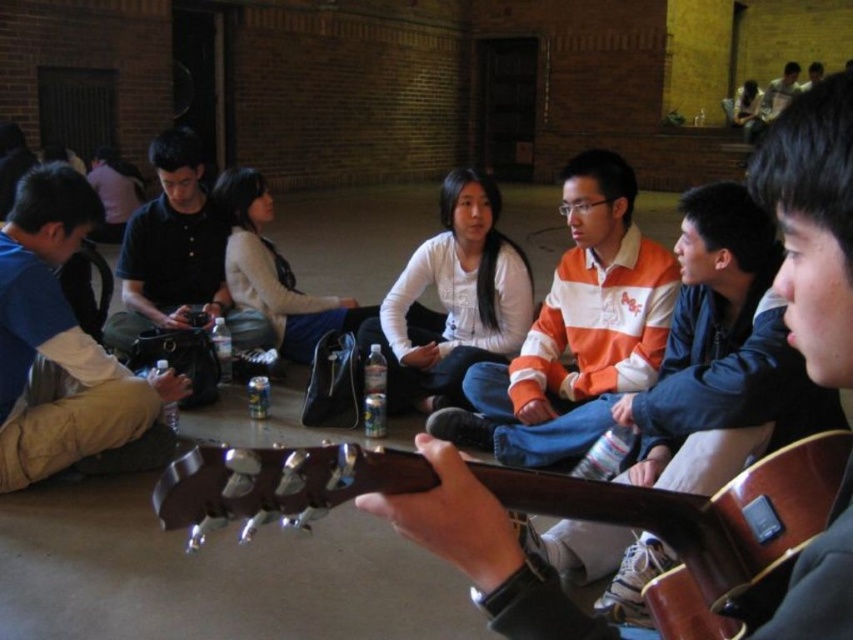
Question: Which point appears farthest from the camera in this image?

Choices:
 (A) (341, 497)
 (B) (766, 90)
 (C) (849, 488)

Answer: (B)

Question: Is brown wood guitar at center to the left of blue fabric shirt at left from the viewer's perspective?

Choices:
 (A) no
 (B) yes

Answer: (A)

Question: Does brown wood guitar at center appear on the right side of matte brown guitar at center?

Choices:
 (A) yes
 (B) no

Answer: (B)

Question: Which is nearer to the white striped sweater at center?

Choices:
 (A) brown wood guitar at center
 (B) matte black shirt at upper right
 (C) matte brown guitar at center

Answer: (A)

Question: Which object is closer to the camera taking this photo?

Choices:
 (A) matte brown guitar at center
 (B) brown wood guitar at center

Answer: (A)

Question: Is the position of white striped sweater at center less distant than that of blue fabric shirt at left?

Choices:
 (A) yes
 (B) no

Answer: (B)